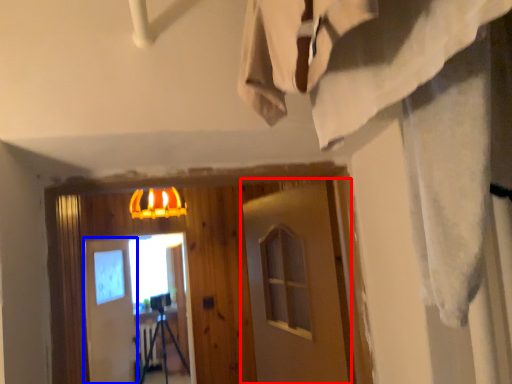
Question: Which point is further to the camera, barn door (highlighted by a red box) or barn door (highlighted by a blue box)?

Choices:
 (A) barn door
 (B) barn door

Answer: (B)